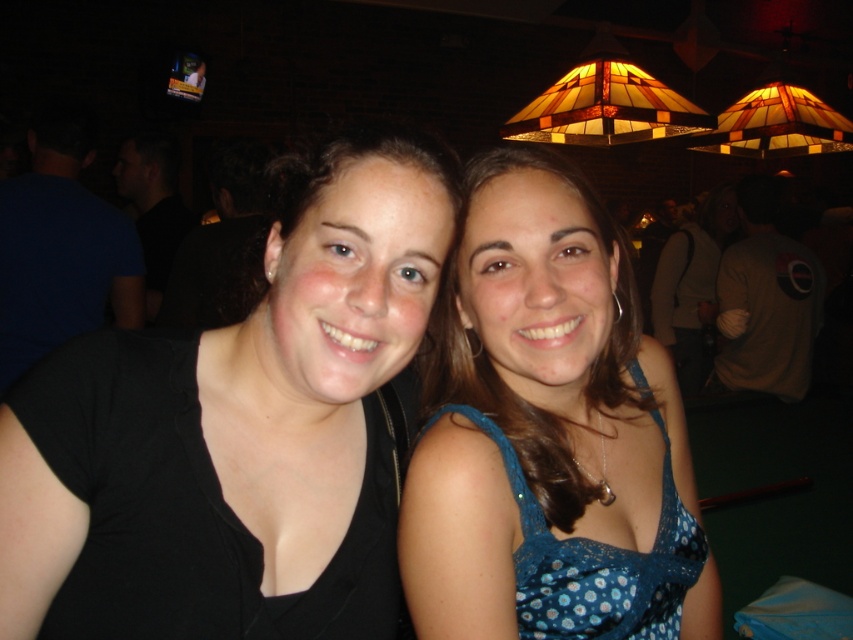
Who is positioned more to the right, black matte shirt at left or blue dotted dress at center?

blue dotted dress at center is more to the right.

This screenshot has height=640, width=853. What do you see at coordinates (238, 426) in the screenshot?
I see `black matte shirt at left` at bounding box center [238, 426].

Identify the location of black matte shirt at left. (238, 426).